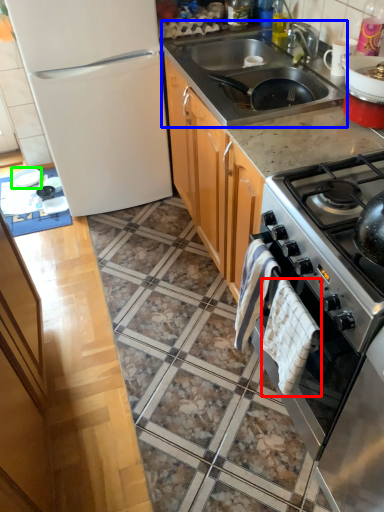
Question: Considering the real-world distances, which object is farthest from blanket (highlighted by a red box)? sink (highlighted by a blue box) or appliance (highlighted by a green box)?

Choices:
 (A) sink
 (B) appliance

Answer: (B)